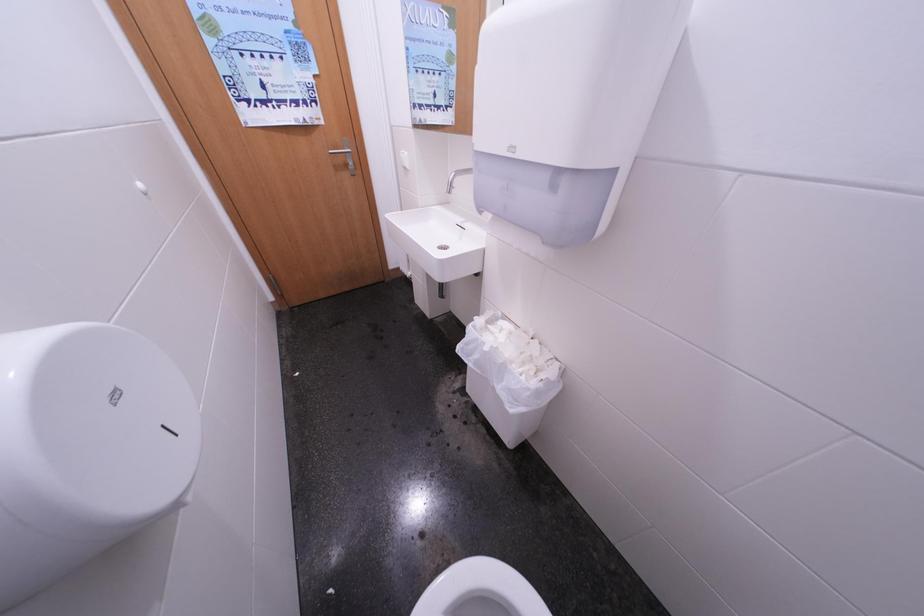
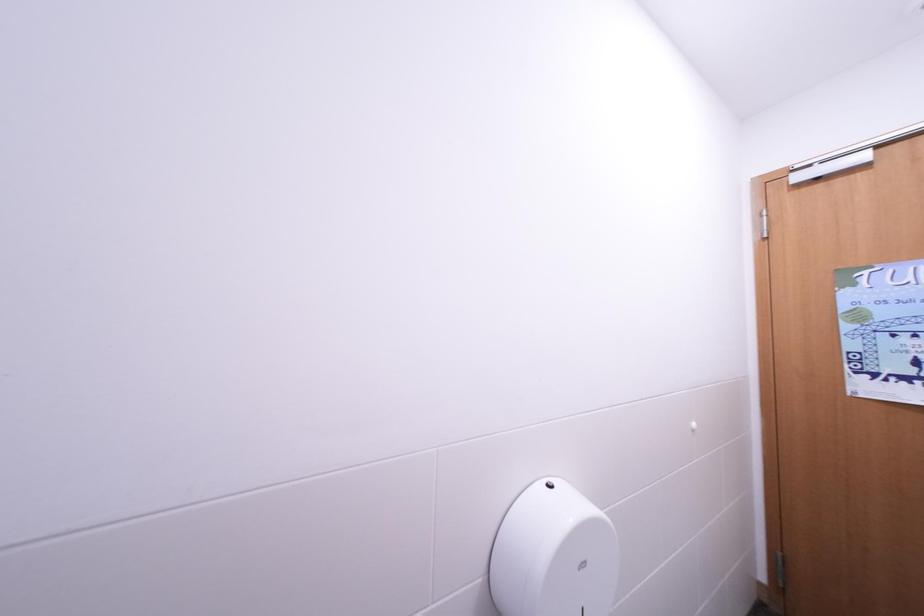
Question: The first image is from the beginning of the video and the second image is from the end. How did the camera likely rotate when shooting the video?

Choices:
 (A) Left
 (B) Right
 (C) Up
 (D) Down

Answer: (A)